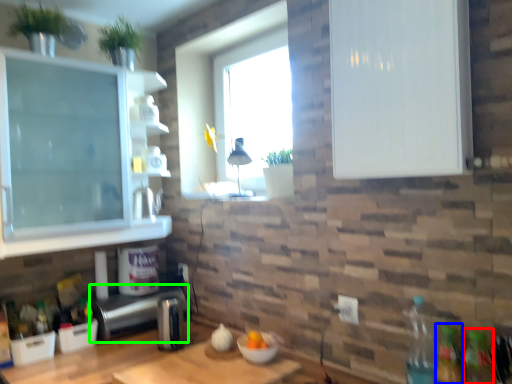
Question: Which object is positioned farthest from bottle (highlighted by a red box)? Select from bottle (highlighted by a blue box) and appliance (highlighted by a green box).

Choices:
 (A) bottle
 (B) appliance

Answer: (B)